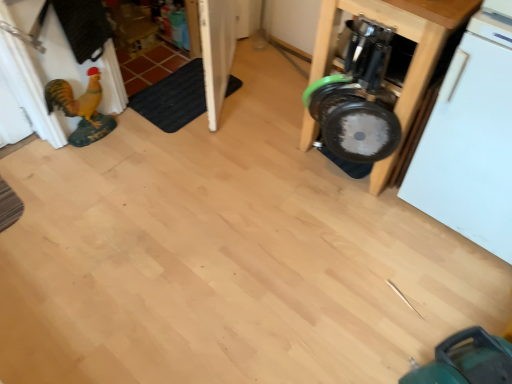
Question: Is metallic silver dumbbell at right placed right next to black rubber mat at lower left?

Choices:
 (A) yes
 (B) no

Answer: (B)

Question: Is metallic silver dumbbell at right oriented towards black rubber mat at lower left?

Choices:
 (A) no
 (B) yes

Answer: (A)

Question: Is metallic silver dumbbell at right to the left of black rubber mat at lower left from the viewer's perspective?

Choices:
 (A) no
 (B) yes

Answer: (A)

Question: Would you say black rubber mat at lower left is part of metallic silver dumbbell at right's contents?

Choices:
 (A) yes
 (B) no

Answer: (B)

Question: From the image's perspective, is metallic silver dumbbell at right on black rubber mat at lower left?

Choices:
 (A) no
 (B) yes

Answer: (A)

Question: Is metallic silver dumbbell at right positioned before black rubber mat at lower left?

Choices:
 (A) no
 (B) yes

Answer: (B)

Question: Is white matte dishwasher at right positioned beyond the bounds of black rubber mat at lower left?

Choices:
 (A) no
 (B) yes

Answer: (B)

Question: Does white matte dishwasher at right touch black rubber mat at lower left?

Choices:
 (A) no
 (B) yes

Answer: (A)

Question: Is white matte dishwasher at right aimed at black rubber mat at lower left?

Choices:
 (A) no
 (B) yes

Answer: (A)

Question: Is white matte dishwasher at right to the right of black rubber mat at lower left from the viewer's perspective?

Choices:
 (A) yes
 (B) no

Answer: (A)

Question: From a real-world perspective, is white matte dishwasher at right on top of black rubber mat at lower left?

Choices:
 (A) yes
 (B) no

Answer: (A)

Question: From the image's perspective, does white matte dishwasher at right appear lower than black rubber mat at lower left?

Choices:
 (A) no
 (B) yes

Answer: (B)

Question: Can you confirm if white matte dishwasher at right is bigger than metallic silver dumbbell at right?

Choices:
 (A) yes
 (B) no

Answer: (B)